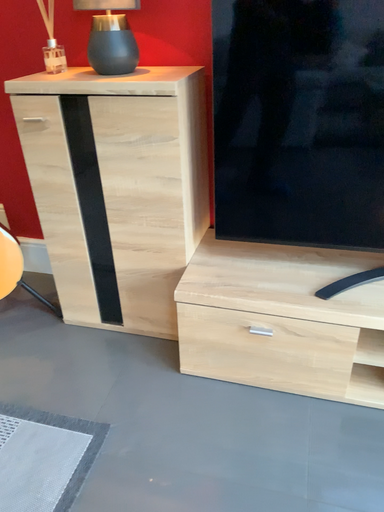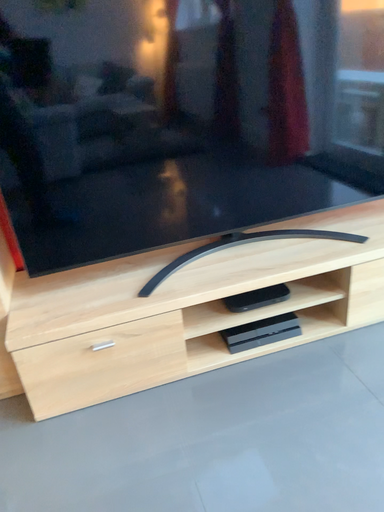
Question: Which way did the camera rotate in the video?

Choices:
 (A) rotated downward
 (B) rotated upward

Answer: (B)